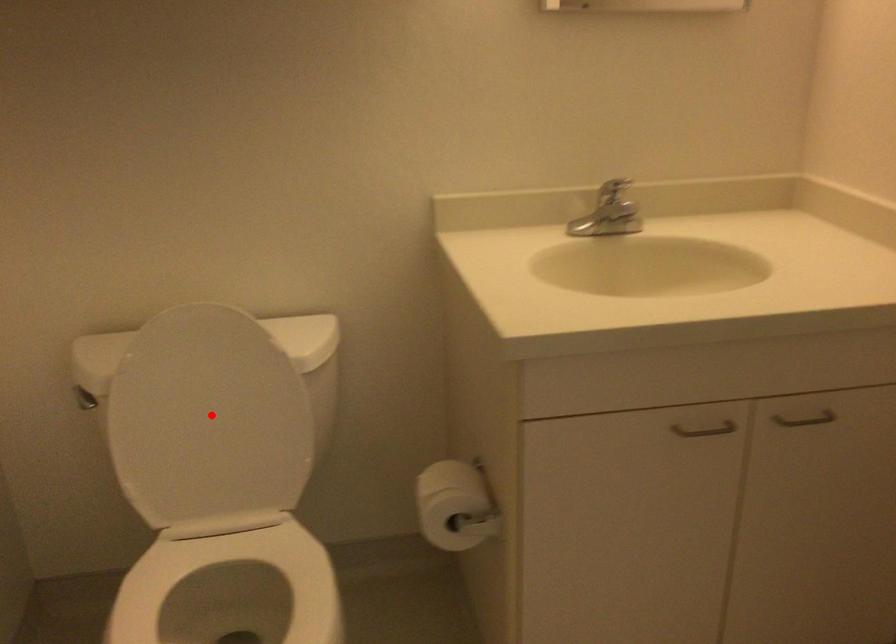
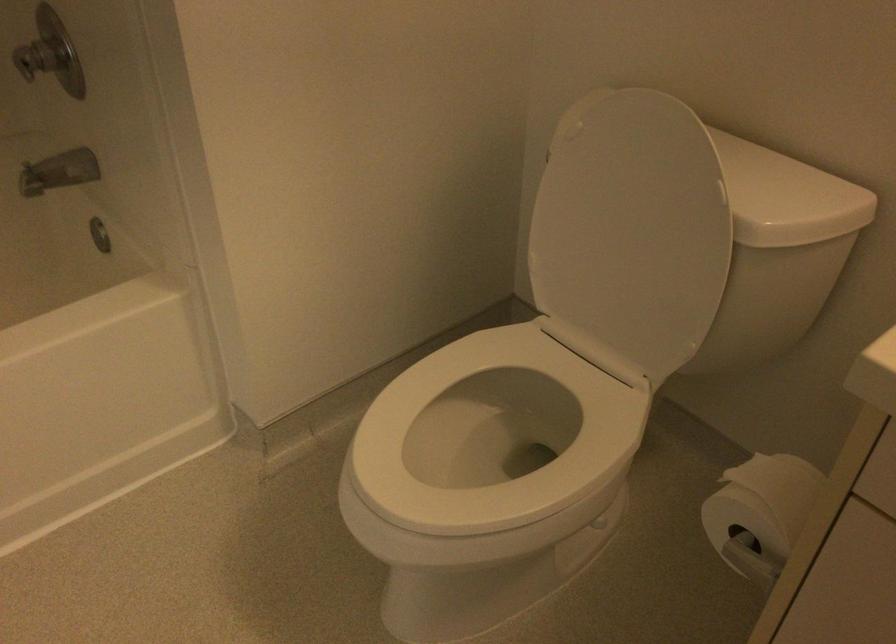
In the second image, find the point that corresponds to the highlighted location in the first image.

(631, 232)